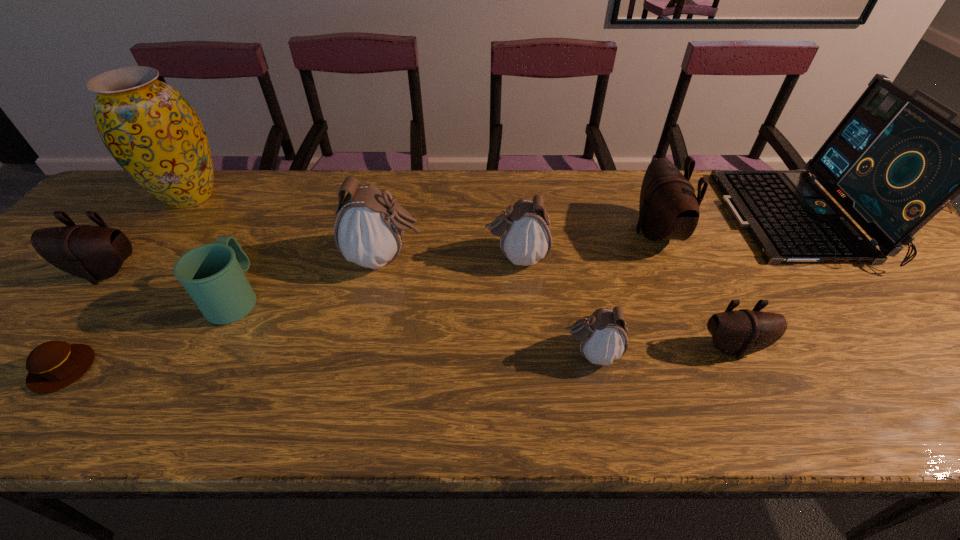
Find the location of `vacant area between the biggest white pouch and the seventh object from right to left`. vacant area between the biggest white pouch and the seventh object from right to left is located at coordinates 310,278.

I want to click on free space between the smallest brown pouch and the vase, so click(461, 272).

The image size is (960, 540). Identify the location of object that is the third closest one to the leftmost pouch. (213, 274).

Point out which object is positioned as the nearest to the biggest brown pouch. Please provide its 2D coordinates. Your answer should be formatted as a tuple, i.e. [(x, y)], where the tuple contains the x and y coordinates of a point satisfying the conditions above.

[(893, 163)]

Choose which pouch is the second nearest neighbor to the brown muffin. Please provide its 2D coordinates. Your answer should be formatted as a tuple, i.e. [(x, y)], where the tuple contains the x and y coordinates of a point satisfying the conditions above.

[(369, 229)]

Select which pouch is the second closest to the leftmost pouch. Please provide its 2D coordinates. Your answer should be formatted as a tuple, i.e. [(x, y)], where the tuple contains the x and y coordinates of a point satisfying the conditions above.

[(524, 229)]

You are a GUI agent. You are given a task and a screenshot of the screen. Output one action in this format:
    pyautogui.click(x=<x>, y=<y>)
    Task: Click on the white pouch that is the closest to the smallest white pouch
    This screenshot has height=540, width=960.
    Given the screenshot: What is the action you would take?
    pyautogui.click(x=524, y=229)

Locate an element on the screen. Image resolution: width=960 pixels, height=540 pixels. the second closest white pouch to the green mug is located at coordinates (524, 229).

The height and width of the screenshot is (540, 960). In order to click on brown pouch that can be found as the second closest to the rightmost object in this screenshot , I will do `click(742, 332)`.

The width and height of the screenshot is (960, 540). I want to click on brown pouch that is the second closest one to the biggest brown pouch, so click(94, 253).